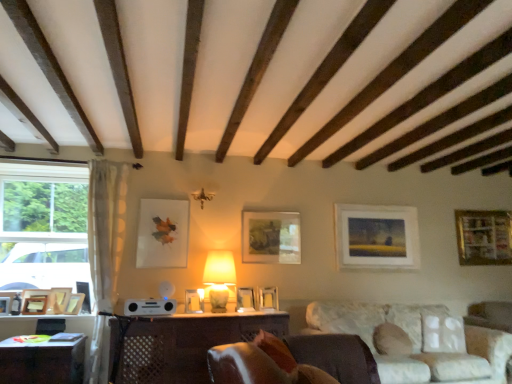
What do you see at coordinates (219, 278) in the screenshot? Image resolution: width=512 pixels, height=384 pixels. I see `matte beige lamp at center` at bounding box center [219, 278].

Image resolution: width=512 pixels, height=384 pixels. Describe the element at coordinates (74, 304) in the screenshot. I see `wooden picture frame at lower left, which is counted as the 4th picture frame, starting from the left` at that location.

Image resolution: width=512 pixels, height=384 pixels. I want to click on white sheer curtain at left, so click(105, 252).

Find the location of a particular element. This screenshot has height=384, width=512. leather at lower center is located at coordinates (335, 357).

Image resolution: width=512 pixels, height=384 pixels. I want to click on wooden table at center, the second table when ordered from left to right, so click(180, 344).

What's the angular difference between satin silver speaker at center and wooden table at center, the second table when ordered from left to right,'s facing directions?

The angular difference between satin silver speaker at center and wooden table at center, the second table when ordered from left to right, is 0.918 degrees.

This screenshot has width=512, height=384. Identify the location of the 1st table in front when counting from the satin silver speaker at center. (180, 344).

Can you confirm if satin silver speaker at center is smaller than wooden table at center, the second table when ordered from left to right?

Indeed, satin silver speaker at center has a smaller size compared to wooden table at center, the second table when ordered from left to right.

Between point (162, 300) and point (157, 331), which one is positioned in front?

The point (157, 331) is closer to the camera.

I want to click on the 6th picture frame to the left of the wooden table at center, the second table when ordered from left to right, starting your count from the anchor, so (x=35, y=305).

Considering the positions of point (45, 309) and point (215, 342), is point (45, 309) closer or farther from the camera than point (215, 342)?

Point (45, 309) is farther from the camera than point (215, 342).

In the image, is wooden picture frame at lower left, the 11th picture frame viewed from the right, positioned in front of or behind wooden table at center, the second table when ordered from left to right?

wooden picture frame at lower left, the 11th picture frame viewed from the right, is positioned farther from the viewer than wooden table at center, the second table when ordered from left to right.

From the picture: From the image's perspective, would you say wooden picture frame at lower left, the 2th picture frame positioned from the left, is positioned over wooden table at center, the first table in the right-to-left sequence?

Correct, wooden picture frame at lower left, the 2th picture frame positioned from the left, appears higher than wooden table at center, the first table in the right-to-left sequence, in the image.

This screenshot has height=384, width=512. What are the coordinates of `rocking chair below the white sheer curtain at left (from the image's perspective)` in the screenshot? It's located at (335, 357).

In terms of size, does leather at lower center appear bigger or smaller than white sheer curtain at left?

Clearly, leather at lower center is smaller in size than white sheer curtain at left.

Which is closer, (329, 362) or (110, 180)?

The point (329, 362) is closer.

In terms of height, does white fabric couch at lower right look taller or shorter compared to matte white picture frame at center right, the 11th picture frame viewed from the left?

In the image, white fabric couch at lower right appears to be taller than matte white picture frame at center right, the 11th picture frame viewed from the left.

Considering the relative sizes of white fabric couch at lower right and matte white picture frame at center right, the 11th picture frame viewed from the left, in the image provided, is white fabric couch at lower right bigger than matte white picture frame at center right, the 11th picture frame viewed from the left,?

Yes.

Consider the image. From the image's perspective, who appears lower, white fabric couch at lower right or matte white picture frame at center right, the 11th picture frame viewed from the left?

white fabric couch at lower right is shown below in the image.

From a real-world perspective, is white fabric couch at lower right positioned over matte white picture frame at center right, the 11th picture frame viewed from the left, based on gravity?

No, from a real-world perspective, white fabric couch at lower right is not over matte white picture frame at center right, the 11th picture frame viewed from the left

Is matte white picture frame at center, the ninth picture frame positioned from the left, next to wooden picture frame at lower left, positioned as the third picture frame in left-to-right order, and touching it?

There is a gap between matte white picture frame at center, the ninth picture frame positioned from the left, and wooden picture frame at lower left, positioned as the third picture frame in left-to-right order.

From a real-world perspective, is matte white picture frame at center, the fourth picture frame from the right, beneath wooden picture frame at lower left, the 10th picture frame in the right-to-left sequence?

No, from a real-world perspective, matte white picture frame at center, the fourth picture frame from the right, is not under wooden picture frame at lower left, the 10th picture frame in the right-to-left sequence.

Does matte white picture frame at center, the ninth picture frame positioned from the left, turn towards wooden picture frame at lower left, positioned as the third picture frame in left-to-right order?

No, matte white picture frame at center, the ninth picture frame positioned from the left, is not aimed at wooden picture frame at lower left, positioned as the third picture frame in left-to-right order.

From the picture: Is satin silver speaker at center oriented towards white sheer curtain at left?

No, satin silver speaker at center is not facing towards white sheer curtain at left.

Who is more distant, satin silver speaker at center or white sheer curtain at left?

satin silver speaker at center is more distant.

Does brown leather swivel chair at lower right have a greater height compared to wooden picture frame at lower left, positioned as the third picture frame in left-to-right order?

Yes.

Which object is thinner, brown leather swivel chair at lower right or wooden picture frame at lower left, the 10th picture frame in the right-to-left sequence?

Thinner between the two is wooden picture frame at lower left, the 10th picture frame in the right-to-left sequence.

Image resolution: width=512 pixels, height=384 pixels. Identify the location of swivel chair on the right of wooden picture frame at lower left, the 10th picture frame in the right-to-left sequence. (490, 315).

Could you tell me if brown leather swivel chair at lower right is turned towards wooden picture frame at lower left, positioned as the third picture frame in left-to-right order?

No, brown leather swivel chair at lower right is not facing towards wooden picture frame at lower left, positioned as the third picture frame in left-to-right order.

At what (x,y) coordinates should I click in order to perform the action: click on table on the right of the satin silver speaker at center. Please return your answer as a coordinate pair (x, y). Looking at the image, I should click on (180, 344).

The image size is (512, 384). There is a wooden table at center, the second table when ordered from left to right. Identify the location of the 1st picture frame above it (from the image's perspective). (35, 305).

When comparing their distances from matte white picture frame at center, marked as the seventh picture frame in a right-to-left arrangement, does white fabric couch at lower right or leather at lower center seem closer?

Answer: The object closer to matte white picture frame at center, marked as the seventh picture frame in a right-to-left arrangement, is white fabric couch at lower right.

Estimate the real-world distances between objects in this image. Which object is closer to wooden picture frame at lower left, positioned as the ninth picture frame in right-to-left order, matte wooden picture frame at center, which is the third picture frame from right to left, or satin silver speaker at center?

satin silver speaker at center lies closer to wooden picture frame at lower left, positioned as the ninth picture frame in right-to-left order, than the other object.

When comparing their distances from matte white picture frame at center, the 7th picture frame from the left, does matte wooden picture frame at center, which is the third picture frame from right to left, or brown leather swivel chair at lower right seem further?

brown leather swivel chair at lower right is further to matte white picture frame at center, the 7th picture frame from the left.

Based on their spatial positions, is matte beige lamp at center or wooden picture frame at lower left, the 10th picture frame in the right-to-left sequence, further from brown leather swivel chair at lower right?

wooden picture frame at lower left, the 10th picture frame in the right-to-left sequence, lies further to brown leather swivel chair at lower right than the other object.

From the image, which object appears to be farther from white fabric couch at lower right, white sheer curtain at left or wooden photo frame at left, acting as the twelfth picture frame starting from the right?

wooden photo frame at left, acting as the twelfth picture frame starting from the right, is positioned further to the anchor white fabric couch at lower right.

Considering their positions, is brown leather swivel chair at lower right positioned closer to wooden table at lower left, which ranks as the 1th table in left-to-right order, than leather at lower center?

leather at lower center is positioned closer to the anchor wooden table at lower left, which ranks as the 1th table in left-to-right order.

Based on their spatial positions, is matte beige lamp at center or wooden table at lower left, which ranks as the 1th table in left-to-right order, further from wooden picture frame at lower left, the 2th picture frame positioned from the left?

matte beige lamp at center lies further to wooden picture frame at lower left, the 2th picture frame positioned from the left, than the other object.

Which object lies further to the anchor point white fabric couch at lower right, satin silver speaker at center or matte white picture frame at center right, the 11th picture frame viewed from the left?

satin silver speaker at center is positioned further to the anchor white fabric couch at lower right.

This screenshot has height=384, width=512. I want to click on rocking chair between wooden picture frame at lower left, positioned as the third picture frame in left-to-right order, and wooden picture frame at right, the twelfth picture frame in the left-to-right sequence, so click(335, 357).

I want to click on curtain situated between wooden picture frame at lower left, the 11th picture frame viewed from the right, and matte wooden picture frame at center, the 10th picture frame viewed from the left, from left to right, so click(x=105, y=252).

The width and height of the screenshot is (512, 384). I want to click on table lamp between matte wooden picture frame at center, the 10th picture frame viewed from the left, and matte white picture frame at center, placed as the 5th picture frame when sorted from right to left, vertically, so click(219, 278).

Where is `table located between white sheer curtain at left and white fabric couch at lower right in the left-right direction`? The width and height of the screenshot is (512, 384). table located between white sheer curtain at left and white fabric couch at lower right in the left-right direction is located at coordinates (180, 344).